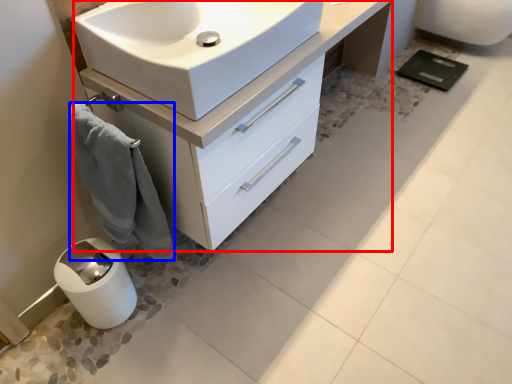
Question: Which object appears farthest to the camera in this image, bathroom cabinet (highlighted by a red box) or bath towel (highlighted by a blue box)?

Choices:
 (A) bathroom cabinet
 (B) bath towel

Answer: (A)